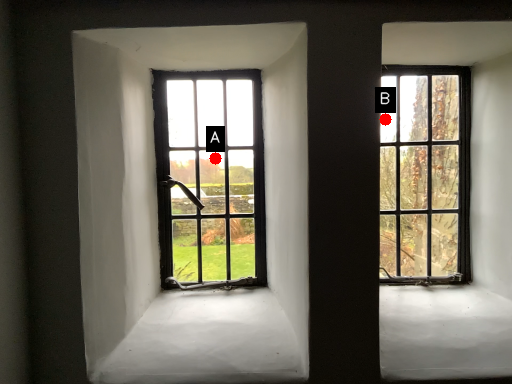
Question: Two points are circled on the image, labeled by A and B beside each circle. Among these points, which one is nearest to the camera?

Choices:
 (A) A is closer
 (B) B is closer

Answer: (A)